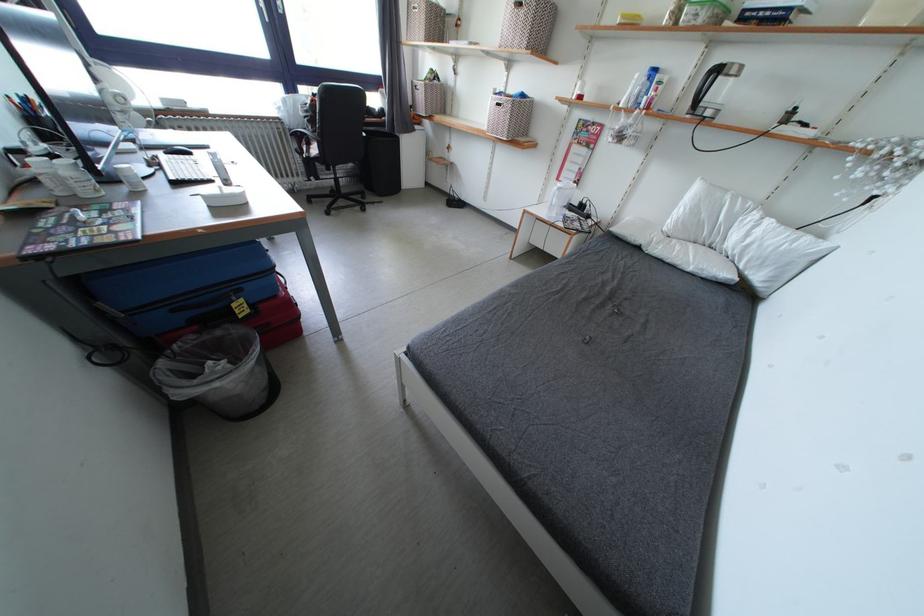
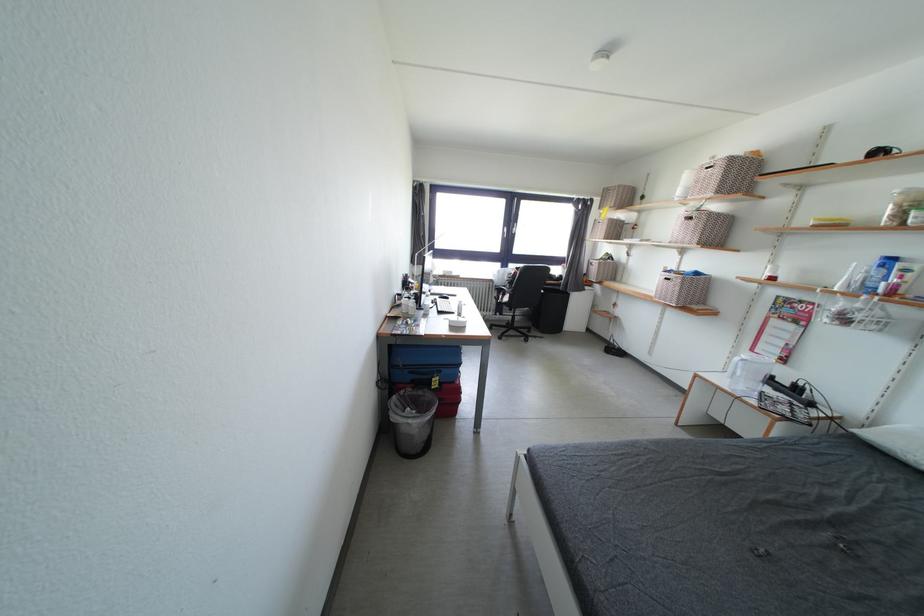
In the second image, find the point that corresponds to (x=319, y=126) in the first image.

(517, 286)